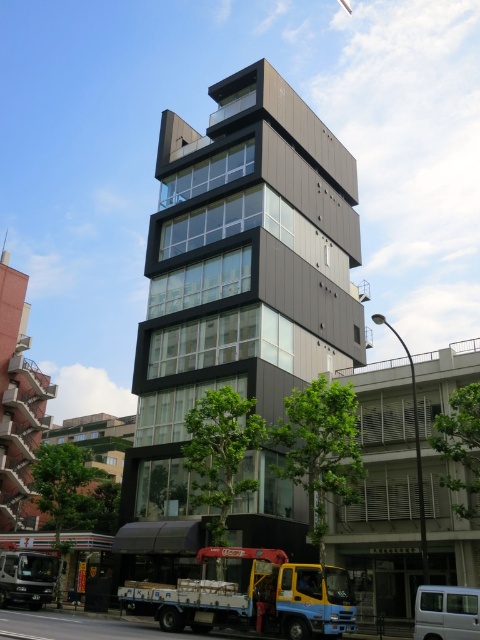
You are standing at the point marked as point [252,596] in the image. Looking towards the modern multi story building, which direction should you turn to face the yellow metallic truck at lower center?

The yellow metallic truck at lower center is located at point [252,596], so you are already facing it. No turn is needed.